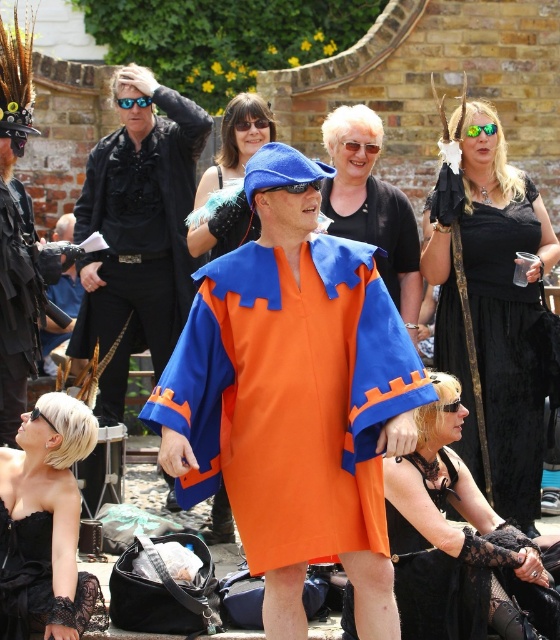
In the scene shown: You are a photographer at the festival trying to capture the central figure in the bright orange tunic. You notice two people wearing black clothing blocking your view. Which of the two, the matte black robe at left or the matte black tank top at center, is closer to you and thus more obstructive?

The matte black robe at left is closer to the viewer than the matte black tank top at center, making it the more obstructive one.

In the festival scene, you see a matte black robe at left and a green reflective plastic goggles at upper center. Which object is positioned to the left of the other?

The matte black robe at left is positioned to the left of green reflective plastic goggles at upper center.

You are a photographer at the festival trying to capture a photo of the orange cotton robe at center and the black lace gloves at lower right. If your camera has a maximum focus range of 20 meters, will you be able to focus on both subjects clearly?

The black lace gloves at lower right is 21.16 meters away from orange cotton robe at center. Since the camera can only focus up to 20 meters, the distance between them exceeds the maximum focus range. Therefore, you cannot focus on both subjects clearly.